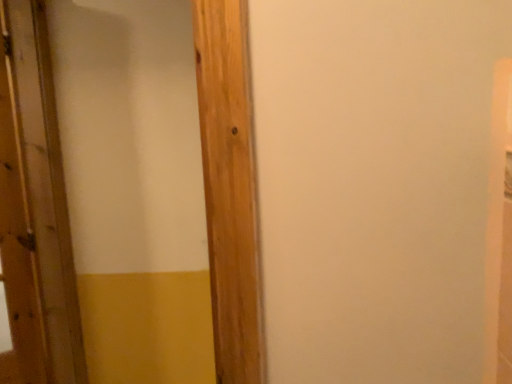
The image size is (512, 384). What do you see at coordinates (34, 211) in the screenshot?
I see `wooden door at left` at bounding box center [34, 211].

Identify the location of wooden door at left. The image size is (512, 384). (34, 211).

At what (x,y) coordinates should I click in order to perform the action: click on wooden door at left. Please return your answer as a coordinate pair (x, y). The height and width of the screenshot is (384, 512). Looking at the image, I should click on 34,211.